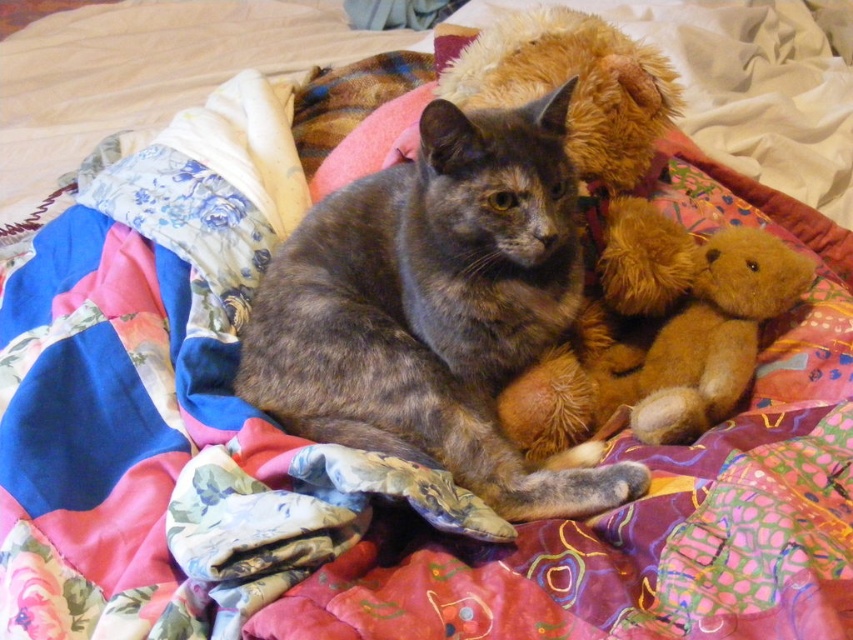
Question: Is gray fur cat at center thinner than fuzzy brown teddy bear at upper right?

Choices:
 (A) no
 (B) yes

Answer: (A)

Question: Which point is closer to the camera?

Choices:
 (A) (711, 272)
 (B) (364, 296)

Answer: (B)

Question: Can you confirm if gray fur cat at center is positioned to the right of fuzzy brown teddy bear at upper right?

Choices:
 (A) no
 (B) yes

Answer: (A)

Question: Which point is farther from the camera taking this photo?

Choices:
 (A) (451, 436)
 (B) (755, 234)

Answer: (B)

Question: Is gray fur cat at center thinner than fuzzy brown teddy bear at upper right?

Choices:
 (A) no
 (B) yes

Answer: (A)